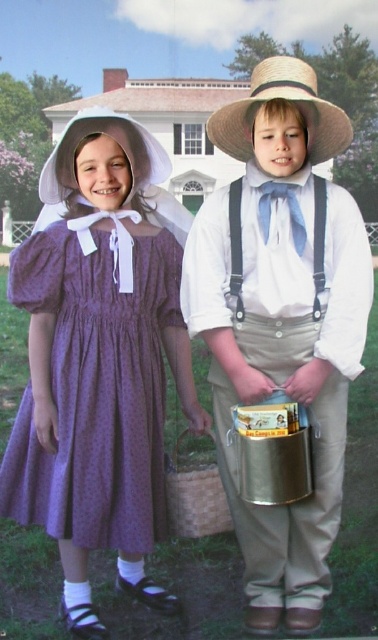
Can you confirm if purple dotted fabric dress at left is shorter than woven straw basket at center?

Incorrect, purple dotted fabric dress at left's height does not fall short of woven straw basket at center's.

Which is in front, point (83, 538) or point (227, 509)?

Point (83, 538) is more forward.

Does point (139, 349) come farther from viewer compared to point (190, 529)?

No, it is in front of (190, 529).

What are the coordinates of `purple dotted fabric dress at left` in the screenshot? It's located at (94, 390).

I want to click on purple dotted fabric dress at left, so click(x=94, y=390).

Does purple dotted fabric dress at left appear under strawhat at right?

Yes, purple dotted fabric dress at left is below strawhat at right.

Locate an element on the screen. Image resolution: width=378 pixels, height=640 pixels. purple dotted fabric dress at left is located at coordinates (94, 390).

Locate an element on the screen. This screenshot has width=378, height=640. purple dotted fabric dress at left is located at coordinates (94, 390).

Does strawhat at right appear on the right side of woven straw basket at center?

Correct, you'll find strawhat at right to the right of woven straw basket at center.

Who is more forward, (345, 134) or (218, 497)?

Positioned in front is point (345, 134).

You are a GUI agent. You are given a task and a screenshot of the screen. Output one action in this format:
    pyautogui.click(x=<x>, y=<y>)
    Task: Click on the strawhat at right
    This screenshot has height=640, width=378.
    Given the screenshot: What is the action you would take?
    pyautogui.click(x=285, y=99)